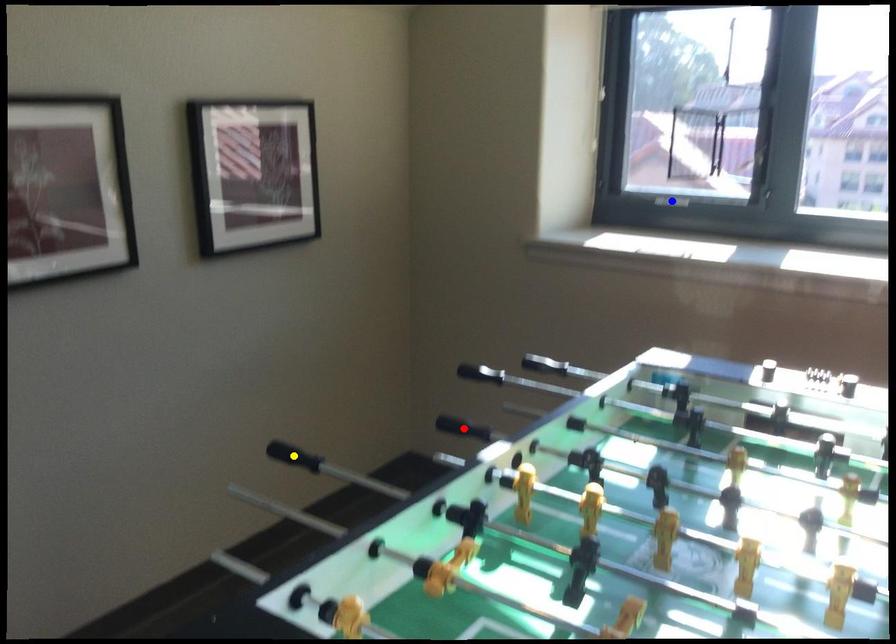
In the scene shown: Order these from nearest to farthest:
blue point, red point, yellow point

yellow point, blue point, red point